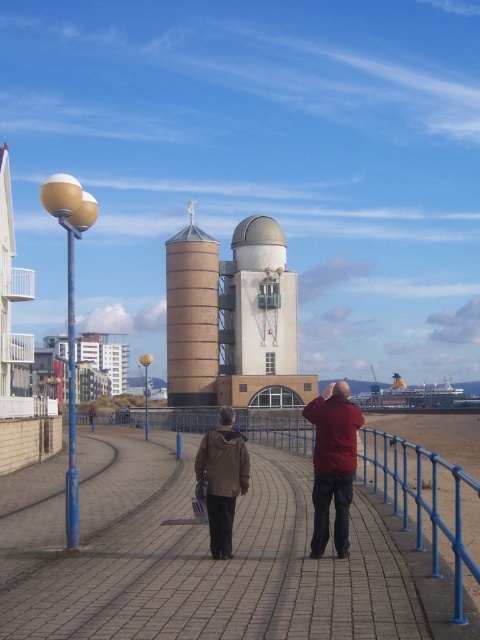
You are standing at the end of the walkway and want to take a photo of both the brown leather jacket at center and the matte red jacket at center. Which person should you focus on first to ensure they are in focus?

You should focus on the brown leather jacket at center first because it is closer to you than the matte red jacket at center, so it will be in focus before the other person.

You are standing on the seaside promenade and see two people walking ahead. One is wearing a brown leather jacket at center and the other a brown matte jacket at center. Which jacket is higher up in the image?

The brown leather jacket at center is located above the brown matte jacket at center in the image.

You are standing on the brick paved walkway at center and want to take a photo of the person in the matte red jacket at center. Can you see their face clearly from your current position?

The brick paved walkway at center is below matte red jacket at center, so the person on the walkway would be looking upward towards the person in the matte red jacket at center. Since the red jacket wearer is taking a photo, their face might be obscured by the camera, making it difficult to see clearly.